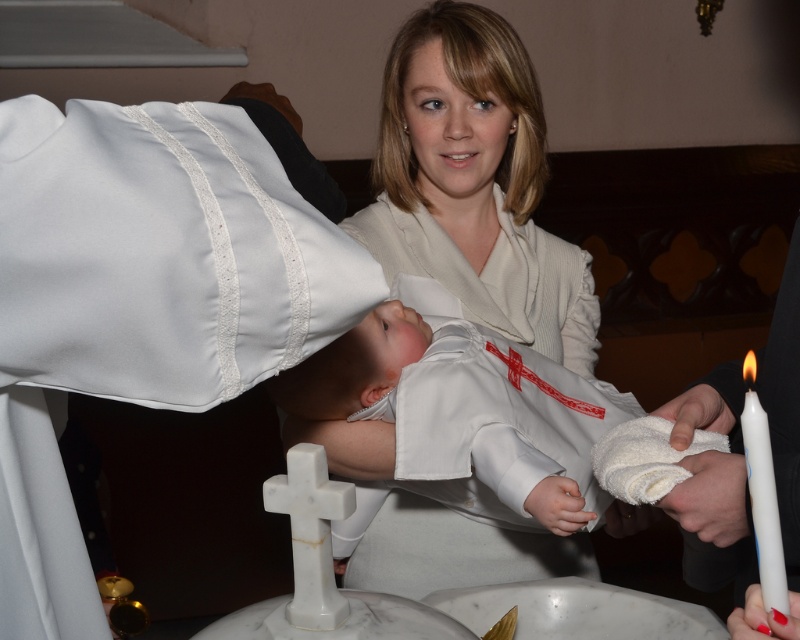
Can you confirm if white satin robe at center is positioned above white smooth towel at lower right?

Correct, white satin robe at center is located above white smooth towel at lower right.

Image resolution: width=800 pixels, height=640 pixels. What do you see at coordinates (454, 550) in the screenshot?
I see `white satin robe at center` at bounding box center [454, 550].

The image size is (800, 640). What are the coordinates of `white satin robe at center` in the screenshot? It's located at (454, 550).

Is white soft towel at lower right thinner than smooth white candle at lower right?

Incorrect, white soft towel at lower right's width is not less than smooth white candle at lower right's.

Who is more forward, (670, 403) or (754, 596)?

Positioned in front is point (754, 596).

Is point (730, 410) behind point (741, 609)?

Yes, point (730, 410) is behind point (741, 609).

Locate an element on the screen. This screenshot has height=640, width=800. white soft towel at lower right is located at coordinates (696, 413).

Looking at this image, does white matte candle at right lie behind white soft towel at lower right?

That is False.

Based on the photo, does white matte candle at right have a greater width compared to white soft towel at lower right?

Correct, the width of white matte candle at right exceeds that of white soft towel at lower right.

Is point (772, 481) closer to camera compared to point (688, 436)?

Yes, it is.

The width and height of the screenshot is (800, 640). In order to click on white matte candle at right in this screenshot , I will do `click(764, 497)`.